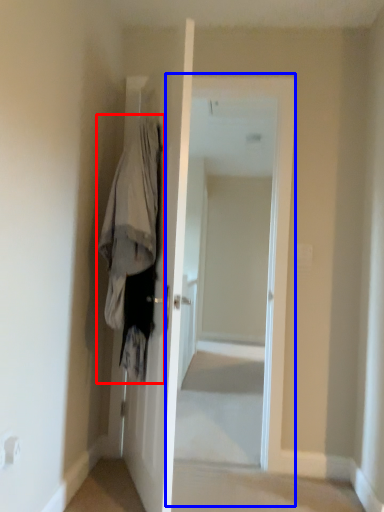
Question: Which object is closer to the camera taking this photo, clothing (highlighted by a red box) or screen door (highlighted by a blue box)?

Choices:
 (A) clothing
 (B) screen door

Answer: (A)